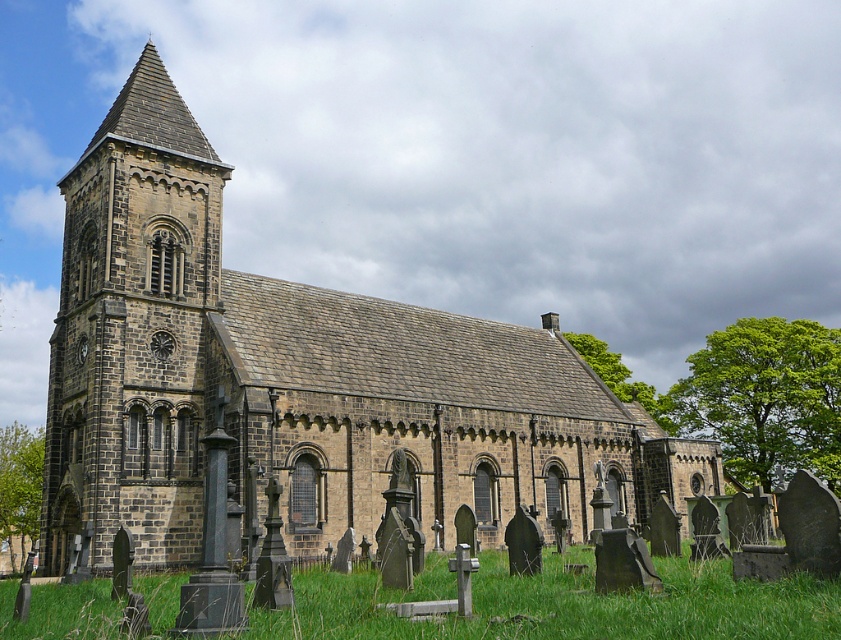
Question: Which object is the farthest from the green grass at lower center?

Choices:
 (A) dark gray stone tower at left
 (B) brown stone church at center

Answer: (A)

Question: Can you confirm if brown stone church at center is smaller than green grass at lower center?

Choices:
 (A) yes
 (B) no

Answer: (B)

Question: Which of the following is the closest to the observer?

Choices:
 (A) dark gray stone tower at left
 (B) green grass at lower center
 (C) brown stone church at center

Answer: (B)

Question: In this image, where is brown stone church at center located relative to dark gray stone tower at left?

Choices:
 (A) left
 (B) right

Answer: (B)

Question: Where is brown stone church at center located in relation to green grass at lower center in the image?

Choices:
 (A) below
 (B) above

Answer: (B)

Question: Which point is closer to the camera taking this photo?

Choices:
 (A) (459, 634)
 (B) (139, 186)

Answer: (A)